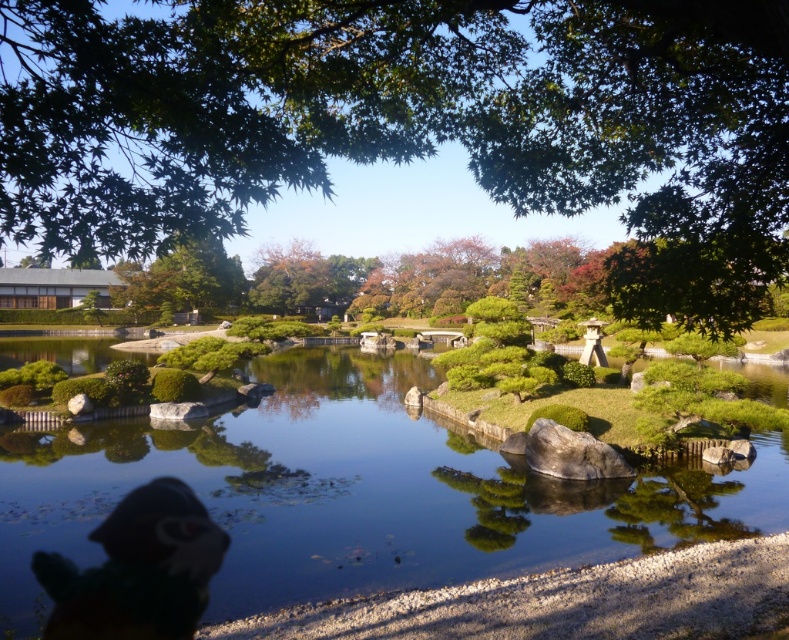
Question: Estimate the real-world distances between objects in this image. Which object is farther from the clear water at center?

Choices:
 (A) gray smooth rock at center
 (B) green leafy tree at upper center

Answer: (B)

Question: Observing the image, what is the correct spatial positioning of green leafy tree at upper center in reference to gray smooth rock at center?

Choices:
 (A) right
 (B) left

Answer: (A)

Question: Among these objects, which one is nearest to the camera?

Choices:
 (A) clear water at center
 (B) gray smooth rock at center
 (C) green leafy tree at upper center

Answer: (C)

Question: Does clear water at center appear under multicolored plush toy at lower left?

Choices:
 (A) yes
 (B) no

Answer: (B)

Question: Can you confirm if multicolored plush toy at lower left is thinner than gray smooth rock at center?

Choices:
 (A) yes
 (B) no

Answer: (B)

Question: Which of the following is the farthest from the observer?

Choices:
 (A) (62, 515)
 (B) (166, 541)

Answer: (A)